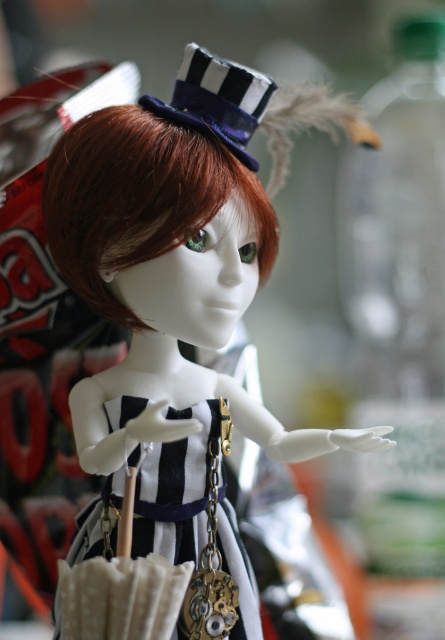
Is matte black dress at center in front of black striped fabric dress at center?

No, it is not.

Is point (160, 464) positioned in front of point (141, 493)?

Yes, point (160, 464) is in front of point (141, 493).

Where is `matte black dress at center`? This screenshot has width=445, height=640. matte black dress at center is located at coordinates (173, 337).

Is matte black dress at center above matte black and white dress hat at upper center?

No, matte black dress at center is not above matte black and white dress hat at upper center.

Who is taller, matte black dress at center or matte black and white dress hat at upper center?

matte black dress at center

Between point (97, 387) and point (194, 88), which one is positioned behind?

Point (97, 387)

The width and height of the screenshot is (445, 640). In order to click on matte black dress at center in this screenshot , I will do `click(173, 337)`.

Which of these two, matte black dress at center or shiny brown wig at center, stands shorter?

Standing shorter between the two is shiny brown wig at center.

Is matte black dress at center positioned behind shiny brown wig at center?

No, matte black dress at center is closer to the viewer.

Is point (234, 324) positioned in front of point (96, 141)?

No, it is behind (96, 141).

You are a GUI agent. You are given a task and a screenshot of the screen. Output one action in this format:
    pyautogui.click(x=<x>, y=<y>)
    Task: Click on the matte black dress at center
    
    Given the screenshot: What is the action you would take?
    pyautogui.click(x=173, y=337)